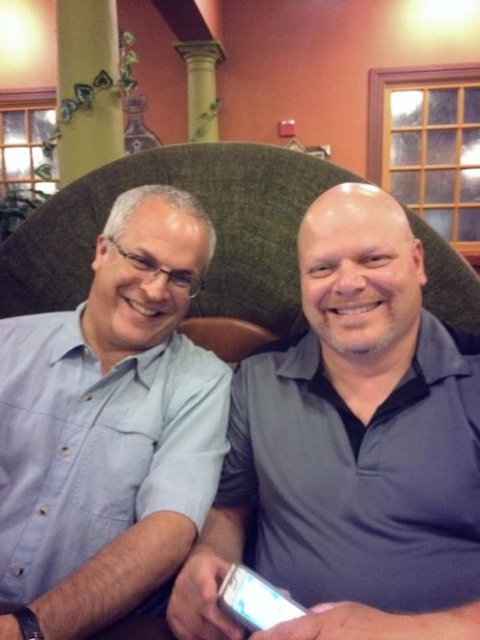
You are a photographer adjusting the camera focus. You notice two shirts in the frame, the light blue shirt at center and the gray matte shirt at center. Which shirt should you focus on to ensure it appears clearer in the photo if you want the larger one to be sharp?

The light blue shirt at center has a larger size compared to the gray matte shirt at center, so you should focus on the light blue shirt at center to ensure it appears clearer in the photo.

You are a photographer adjusting the camera settings to ensure both the light blue shirt at center and the gray matte shirt at center are clearly visible. Since the camera has a focus range that can only accommodate one shirt width, which shirt should you prioritize focusing on based on their sizes?

The light blue shirt at center has a smaller width than the gray matte shirt at center. Therefore, you should prioritize focusing on the gray matte shirt at center because it is wider and might require more detailed focus to ensure clarity.